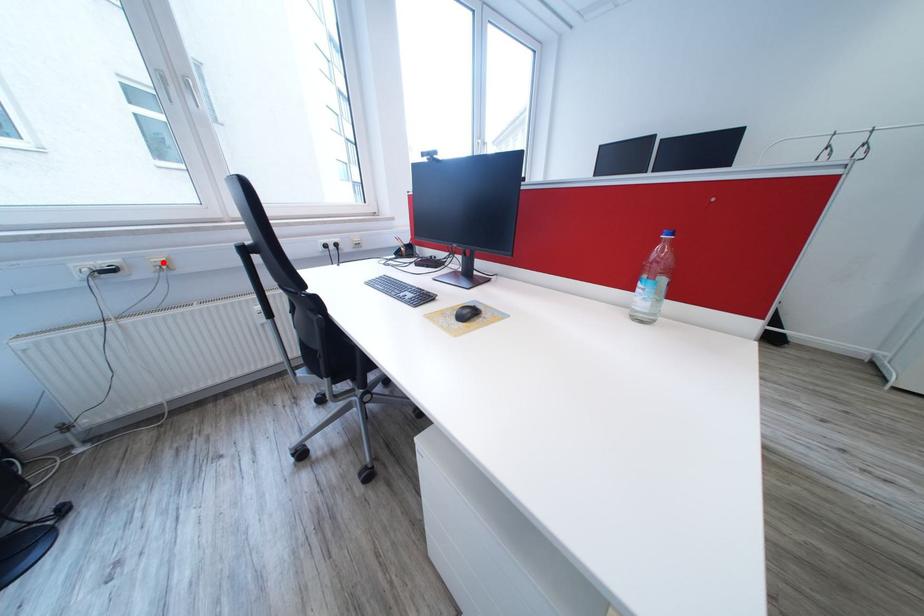
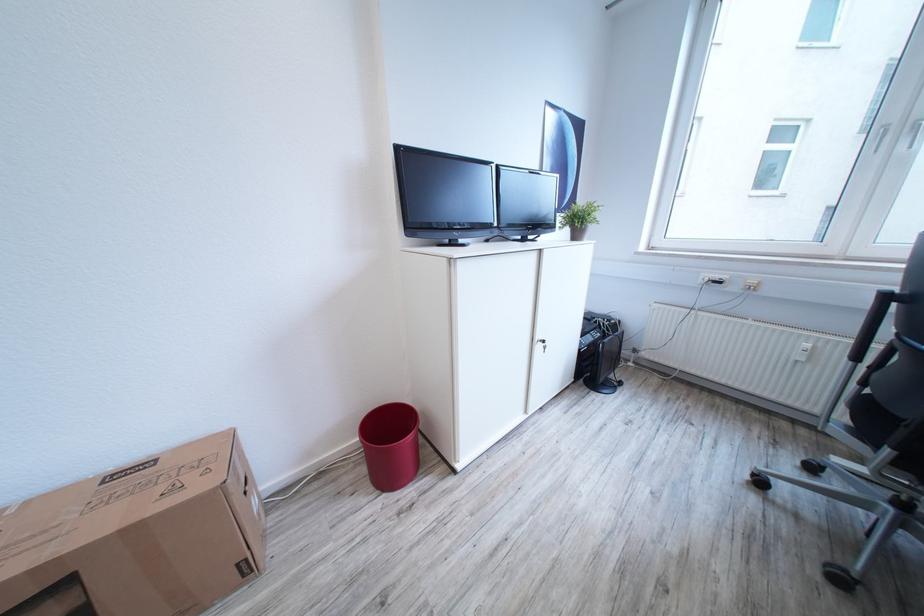
Locate, in the second image, the point that corresponds to the highlighted location in the first image.

(759, 284)